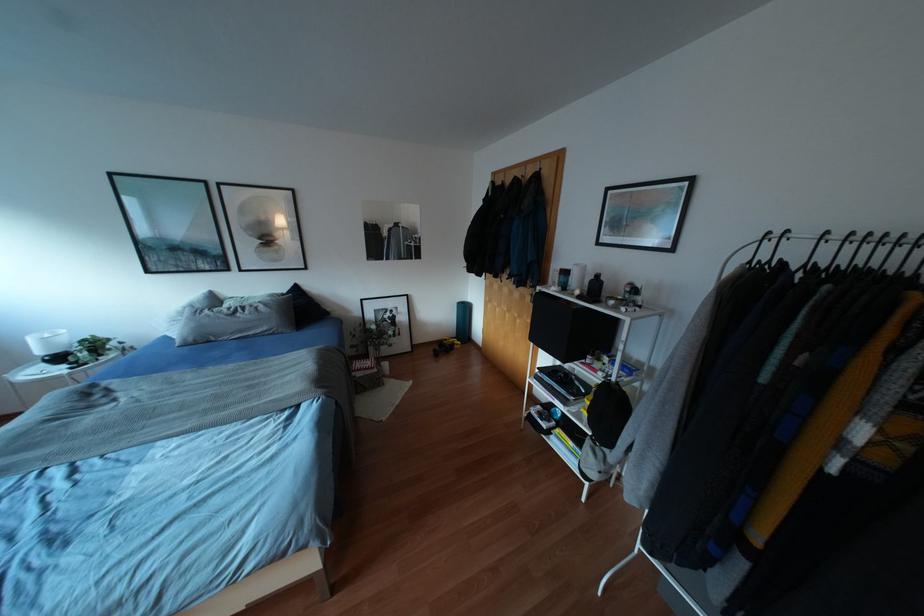
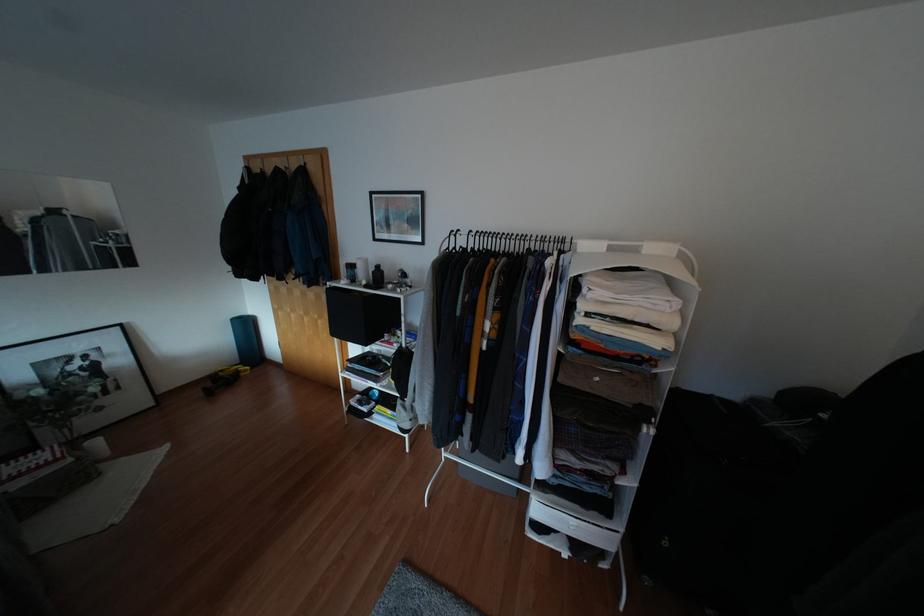
Locate, in the second image, the point that corresponds to (x=384, y=363) in the first image.

(94, 442)